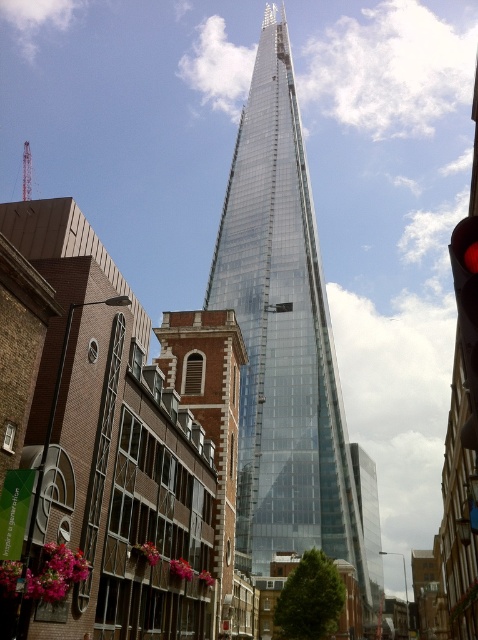
Question: Is transparent glass tower at center further to camera compared to red glass traffic light at right?

Choices:
 (A) no
 (B) yes

Answer: (B)

Question: Observing the image, what is the correct spatial positioning of transparent glass tower at center in reference to red glass traffic light at right?

Choices:
 (A) below
 (B) above

Answer: (B)

Question: Observing the image, what is the correct spatial positioning of transparent glass tower at center in reference to red glass traffic light at right?

Choices:
 (A) above
 (B) below

Answer: (A)

Question: Which point appears closest to the camera in this image?

Choices:
 (A) (468, 250)
 (B) (333, 480)

Answer: (A)

Question: Which point is farther to the camera?

Choices:
 (A) (369, 502)
 (B) (474, 433)

Answer: (A)